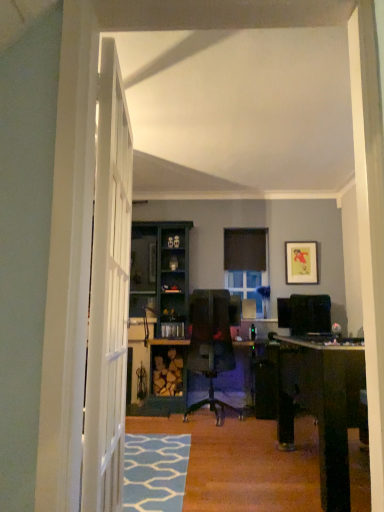
Question: From the image's perspective, is black matte curtain at center on top of yellow paper picture frame at upper right?

Choices:
 (A) yes
 (B) no

Answer: (A)

Question: Can yellow paper picture frame at upper right be found inside black matte curtain at center?

Choices:
 (A) no
 (B) yes

Answer: (A)

Question: Does black matte curtain at center have a lesser width compared to yellow paper picture frame at upper right?

Choices:
 (A) no
 (B) yes

Answer: (A)

Question: Considering the relative sizes of black matte curtain at center and yellow paper picture frame at upper right in the image provided, is black matte curtain at center taller than yellow paper picture frame at upper right?

Choices:
 (A) no
 (B) yes

Answer: (A)

Question: Could you tell me if black matte curtain at center is turned towards yellow paper picture frame at upper right?

Choices:
 (A) yes
 (B) no

Answer: (B)

Question: From a real-world perspective, is black matte curtain at center physically above yellow paper picture frame at upper right?

Choices:
 (A) yes
 (B) no

Answer: (A)

Question: Does black matte curtain at center appear on the left side of clear glass window at center?

Choices:
 (A) yes
 (B) no

Answer: (B)

Question: Is black matte curtain at center surrounding clear glass window at center?

Choices:
 (A) yes
 (B) no

Answer: (B)

Question: Is black matte curtain at center shorter than clear glass window at center?

Choices:
 (A) yes
 (B) no

Answer: (A)

Question: From a real-world perspective, is black matte curtain at center beneath clear glass window at center?

Choices:
 (A) no
 (B) yes

Answer: (A)

Question: Is there a large distance between black matte curtain at center and clear glass window at center?

Choices:
 (A) no
 (B) yes

Answer: (A)

Question: Considering the relative sizes of black matte curtain at center and clear glass window at center in the image provided, is black matte curtain at center thinner than clear glass window at center?

Choices:
 (A) yes
 (B) no

Answer: (A)

Question: From the image's perspective, is clear glass window at center over black matte curtain at center?

Choices:
 (A) yes
 (B) no

Answer: (B)